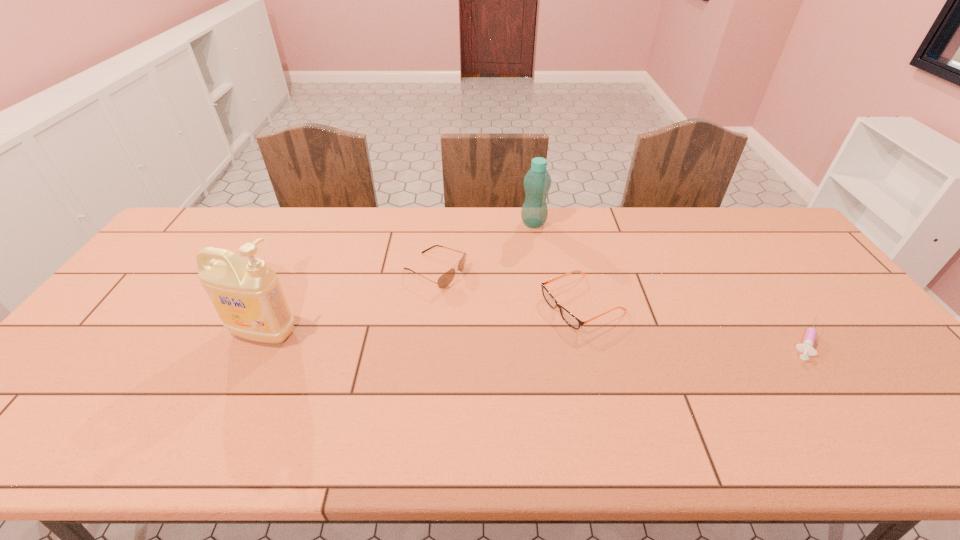
Where is `vacant space on the desktop that is between the tallest object and the shortest object and is positioned on the front-facing side of the second object from left to right`? The width and height of the screenshot is (960, 540). vacant space on the desktop that is between the tallest object and the shortest object and is positioned on the front-facing side of the second object from left to right is located at coordinates (587, 337).

Where is `free spot on the desktop that is between the leftmost object and the syringe and is positioned at the front cap of the second tallest object`? free spot on the desktop that is between the leftmost object and the syringe and is positioned at the front cap of the second tallest object is located at coordinates [595, 337].

This screenshot has height=540, width=960. Find the location of `vacant space on the desktop that is between the tallest object and the rightmost object and is positioned on the front-facing side of the second shortest object`. vacant space on the desktop that is between the tallest object and the rightmost object and is positioned on the front-facing side of the second shortest object is located at coordinates (513, 336).